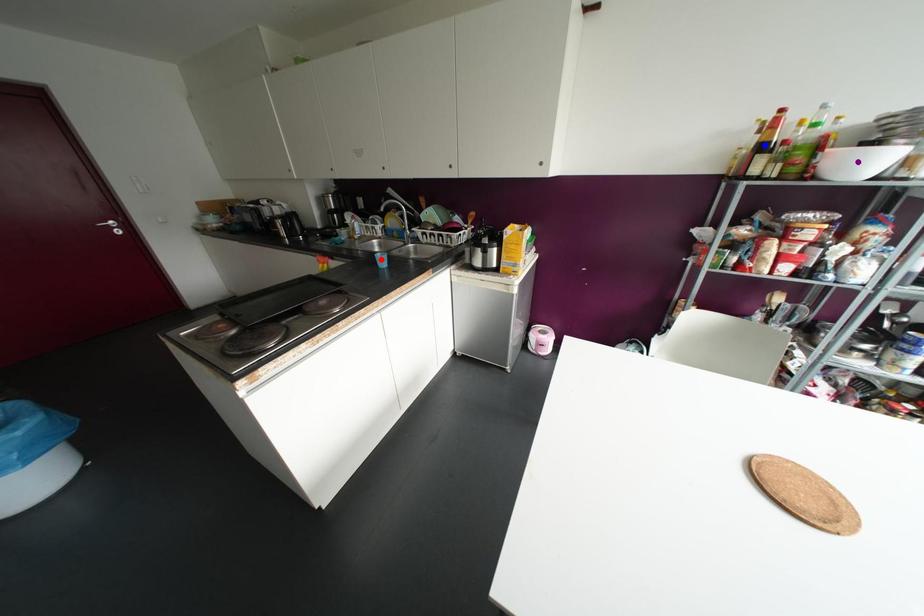
Order these from farthest to nearest:
1. purple point
2. red point
3. blue point

red point → blue point → purple point